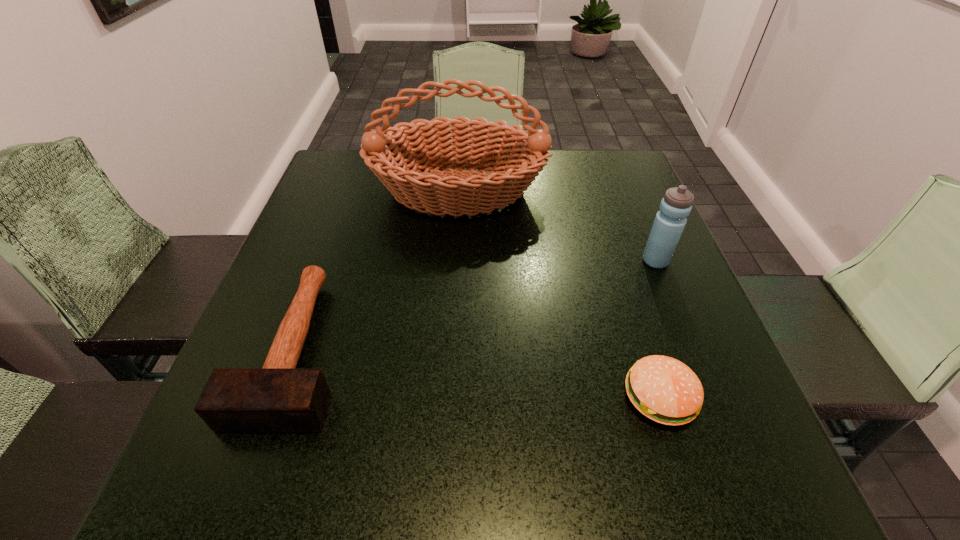
Find the location of `vacant area between the water bottle and the mallet`. vacant area between the water bottle and the mallet is located at coordinates (476, 304).

Locate an element on the screen. vacant space that is in between the mallet and the shortest object is located at coordinates (479, 372).

Locate an element on the screen. free space between the patty and the mallet is located at coordinates (479, 372).

Locate an element on the screen. The height and width of the screenshot is (540, 960). vacant area that lies between the mallet and the patty is located at coordinates (479, 372).

Locate which object is the second closest to the third nearest object. Please provide its 2D coordinates. Your answer should be formatted as a tuple, i.e. [(x, y)], where the tuple contains the x and y coordinates of a point satisfying the conditions above.

[(665, 390)]

You are a GUI agent. You are given a task and a screenshot of the screen. Output one action in this format:
    pyautogui.click(x=<x>, y=<y>)
    Task: Click on the third closest object relative to the shortest object
    This screenshot has width=960, height=540.
    Given the screenshot: What is the action you would take?
    pyautogui.click(x=278, y=397)

Locate an element on the screen. The width and height of the screenshot is (960, 540). free location that satisfies the following two spatial constraints: 1. on the front side of the tallest object; 2. on the left side of the third nearest object is located at coordinates (453, 261).

The height and width of the screenshot is (540, 960). In order to click on vacant space that satisfies the following two spatial constraints: 1. on the hammer head face of the mallet; 2. on the right side of the patty in this screenshot , I will do `click(279, 397)`.